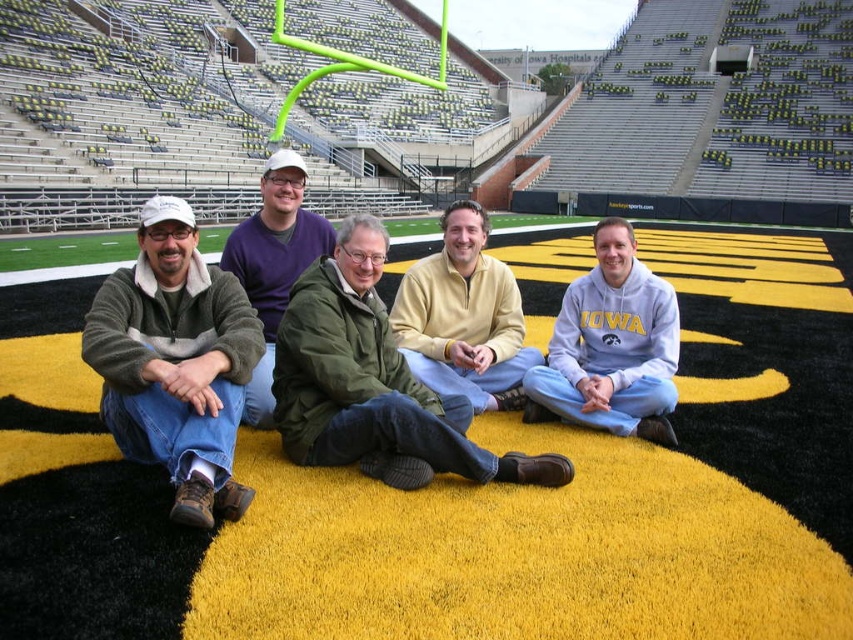
You are trying to locate the light blue sweatshirt at center in a group photo taken at the football stadium. Which direction should you look relative to the green matte jacket at center?

The light blue sweatshirt at center is on the right side of the green matte jacket at center.

You are a photographer trying to capture a group photo of the five individuals in the football stadium. You notice the green matte jacket at center and the light blue sweatshirt at center. Which clothing item should you adjust to ensure it fits within the frame without overcrowding the group?

The green matte jacket at center has a larger width than the light blue sweatshirt at center, so adjusting the position of the green matte jacket at center would help reduce overcrowding in the frame.